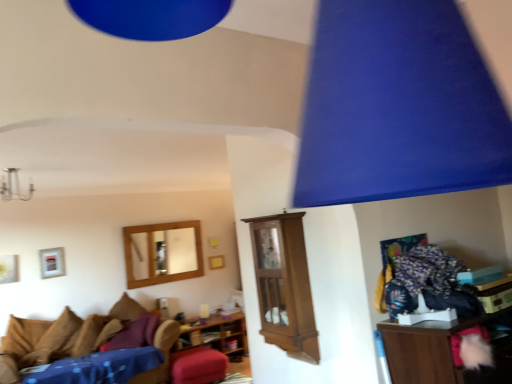
Question: Which direction should I rotate to face wooden/matte picture frame at center, which is the first picture frame in back-to-front order, — up or down?

Choices:
 (A) down
 (B) up

Answer: (A)

Question: Is metallic chandelier at upper left oriented towards wooden shelf at center, arranged as the 2th shelf when viewed from the right?

Choices:
 (A) no
 (B) yes

Answer: (A)

Question: Is metallic chandelier at upper left completely or partially outside of wooden shelf at center, which appears as the first shelf when ordered from the bottom?

Choices:
 (A) yes
 (B) no

Answer: (A)

Question: From a real-world perspective, is metallic chandelier at upper left beneath wooden shelf at center, arranged as the 2th shelf when viewed from the right?

Choices:
 (A) no
 (B) yes

Answer: (A)

Question: Is metallic chandelier at upper left to the right of wooden shelf at center, the 1th shelf positioned from the left, from the viewer's perspective?

Choices:
 (A) no
 (B) yes

Answer: (A)

Question: Is metallic chandelier at upper left thinner than wooden shelf at center, arranged as the 2th shelf when viewed from the right?

Choices:
 (A) no
 (B) yes

Answer: (B)

Question: Does metallic chandelier at upper left have a greater height compared to wooden shelf at center, arranged as the 2th shelf when viewed from the right?

Choices:
 (A) yes
 (B) no

Answer: (B)

Question: Is brown fabric pillow at lower left, the first pillow positioned from the back, to the left of velvet red stool at center from the viewer's perspective?

Choices:
 (A) no
 (B) yes

Answer: (B)

Question: Is velvet red stool at center a part of brown fabric pillow at lower left, the first pillow positioned from the back?

Choices:
 (A) yes
 (B) no

Answer: (B)

Question: From the image's perspective, does brown fabric pillow at lower left, the first pillow positioned from the back, appear lower than velvet red stool at center?

Choices:
 (A) no
 (B) yes

Answer: (A)

Question: Can we say brown fabric pillow at lower left, the first pillow positioned from the back, lies outside velvet red stool at center?

Choices:
 (A) no
 (B) yes

Answer: (B)

Question: Does brown fabric pillow at lower left, the first pillow positioned from the back, appear on the right side of velvet red stool at center?

Choices:
 (A) yes
 (B) no

Answer: (B)

Question: Is brown fabric pillow at lower left, which is counted as the 2th pillow, starting from the front, positioned with its back to velvet red stool at center?

Choices:
 (A) no
 (B) yes

Answer: (A)

Question: Considering the relative positions of silver metallic picture frame at upper left, the 1th picture frame viewed from the front, and brown suede pillow at lower left, which is the 2th pillow in back-to-front order, in the image provided, is silver metallic picture frame at upper left, the 1th picture frame viewed from the front, to the left of brown suede pillow at lower left, which is the 2th pillow in back-to-front order, from the viewer's perspective?

Choices:
 (A) yes
 (B) no

Answer: (A)